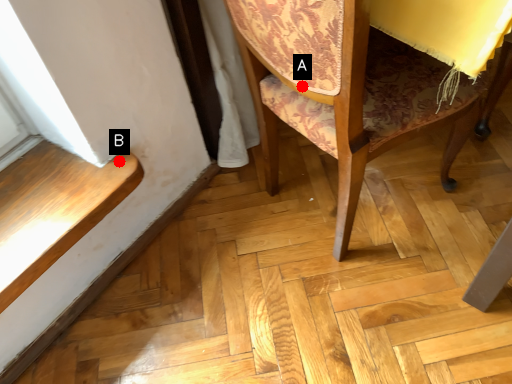
Question: Two points are circled on the image, labeled by A and B beside each circle. Which point is farther from the camera taking this photo?

Choices:
 (A) A is further
 (B) B is further

Answer: (B)